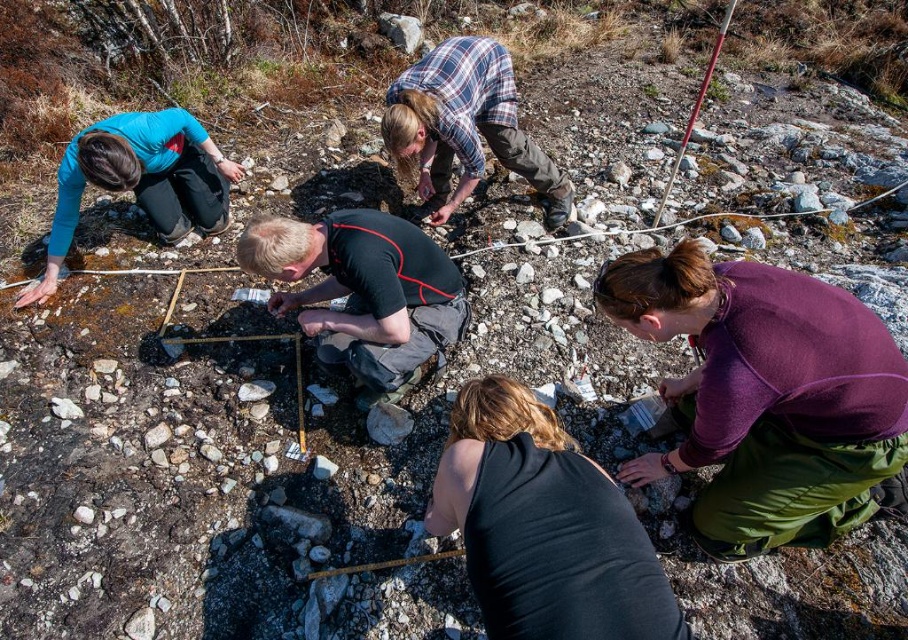
Who is positioned more to the left, black matte tank top at lower center or black matte shirt at center?

black matte shirt at center is more to the left.

Can you confirm if black matte tank top at lower center is smaller than black matte shirt at center?

Yes, black matte tank top at lower center is smaller than black matte shirt at center.

Describe the element at coordinates (543, 525) in the screenshot. I see `black matte tank top at lower center` at that location.

Image resolution: width=908 pixels, height=640 pixels. Find the location of `black matte tank top at lower center`. black matte tank top at lower center is located at coordinates (543, 525).

Who is more distant from viewer, (454, 115) or (206, 179)?

Positioned behind is point (206, 179).

Between point (408, 154) and point (153, 116), which one is positioned behind?

Positioned behind is point (408, 154).

The width and height of the screenshot is (908, 640). I want to click on plaid flannel shirt at upper center, so click(x=464, y=125).

Is point (423, 305) positioned after point (551, 166)?

That is False.

Find the location of a particular element. The width and height of the screenshot is (908, 640). black matte shirt at center is located at coordinates (362, 291).